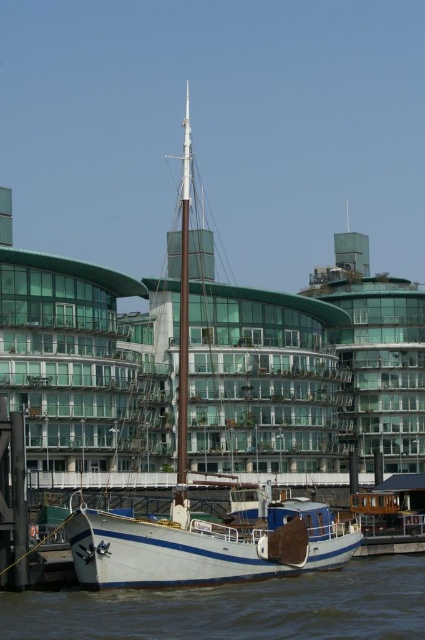
Question: Does white smooth water at lower center have a smaller size compared to white wooden boat at lower center?

Choices:
 (A) yes
 (B) no

Answer: (A)

Question: Can you confirm if white wooden boat at lower center is bigger than white matte mast at center?

Choices:
 (A) yes
 (B) no

Answer: (B)

Question: Among these points, which one is nearest to the camera?

Choices:
 (A) (206, 541)
 (B) (283, 509)

Answer: (A)

Question: Considering the relative positions of white matte boat at center and white wooden boat at lower center in the image provided, where is white matte boat at center located with respect to white wooden boat at lower center?

Choices:
 (A) below
 (B) above

Answer: (B)

Question: Which point is closer to the camera?

Choices:
 (A) click(252, 509)
 (B) click(351, 568)
 (C) click(175, 493)
 (D) click(186, 419)

Answer: (D)

Question: Which point appears closest to the camera in this image?

Choices:
 (A) (116, 560)
 (B) (144, 624)

Answer: (B)